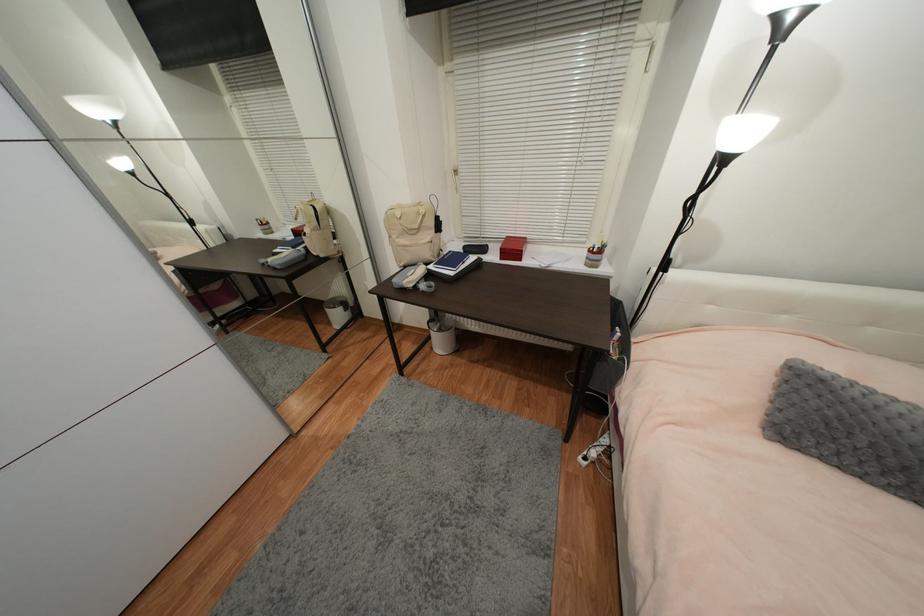
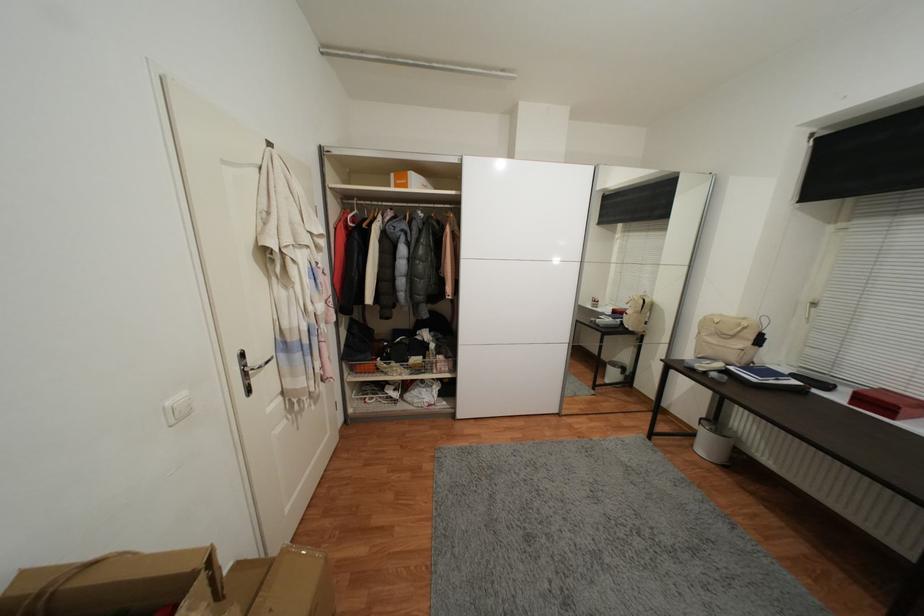
Locate, in the second image, the point that corresponds to point 436,350 in the first image.

(697, 447)